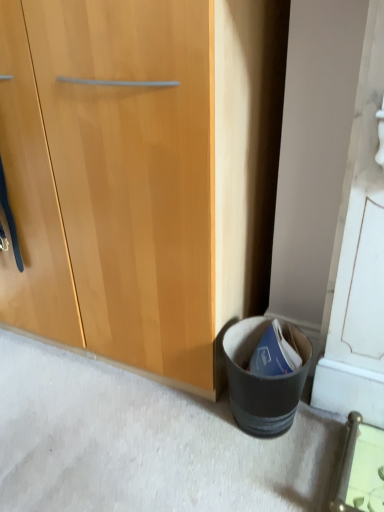
What do you see at coordinates (263, 379) in the screenshot?
I see `matte gray trash can at lower right` at bounding box center [263, 379].

What is the approximate height of matte gray trash can at lower right?

26.73 centimeters.

What are the coordinates of `matte gray trash can at lower right` in the screenshot? It's located at (263, 379).

Where is `matte gray trash can at lower right`? This screenshot has width=384, height=512. matte gray trash can at lower right is located at coordinates (263, 379).